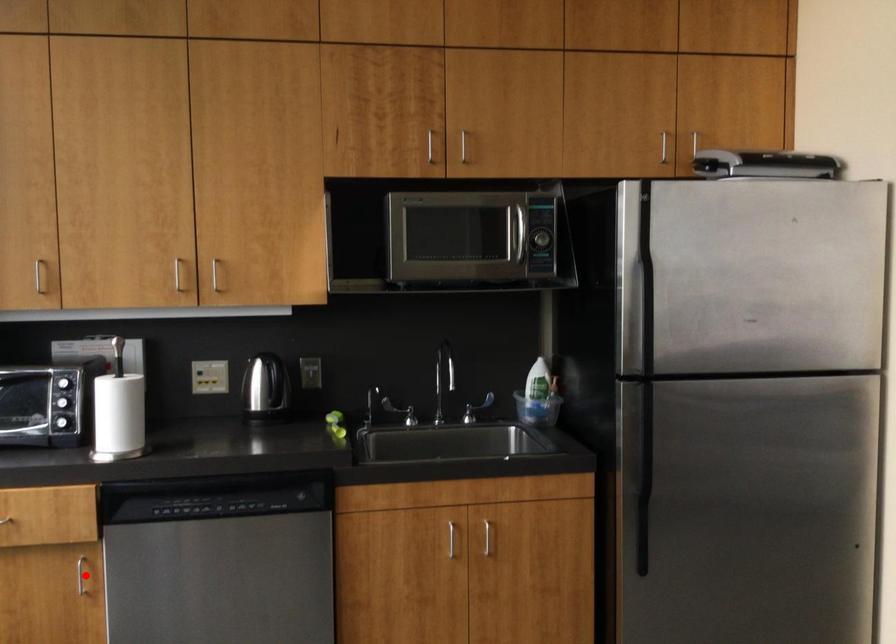
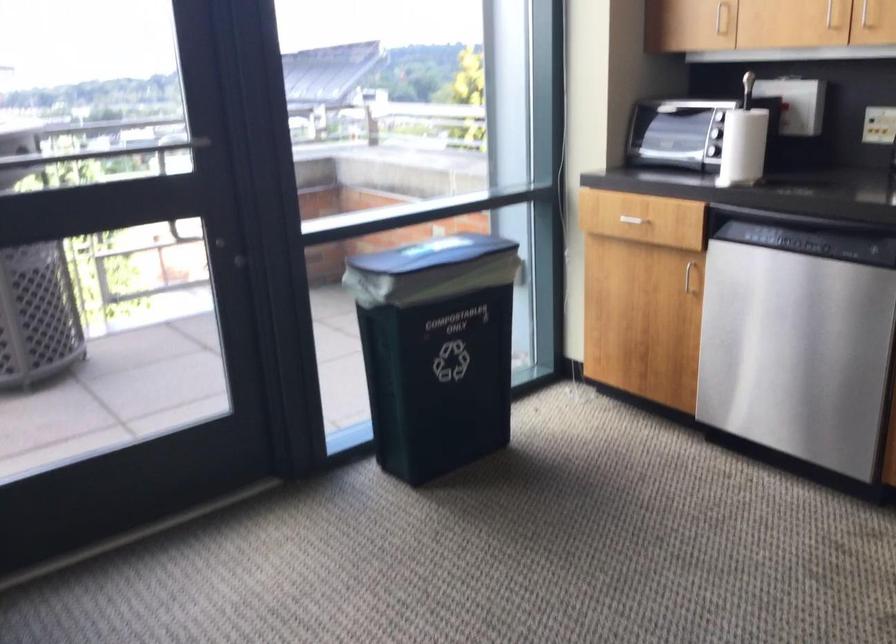
Question: I am providing you with two images of the same scene from different viewpoints. Image1 has a red point marked. In image2, the corresponding 3D location appears at what relative position? Reply with the corresponding letter.

Choices:
 (A) Closer
 (B) Farther

Answer: (B)